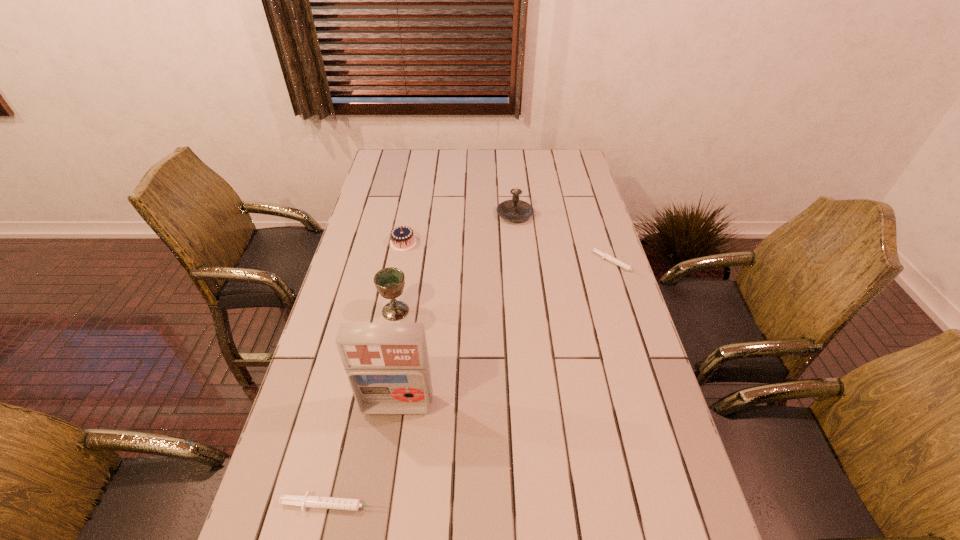
This screenshot has width=960, height=540. What are the coordinates of `the left syringe` in the screenshot? It's located at [349, 504].

Locate an element on the screen. the fifth tallest object is located at coordinates (349, 504).

Where is `the shortest object`? The image size is (960, 540). the shortest object is located at coordinates (623, 265).

Locate an element on the screen. The height and width of the screenshot is (540, 960). the rightmost object is located at coordinates (623, 265).

Where is `chalice`? The image size is (960, 540). chalice is located at coordinates (389, 282).

The height and width of the screenshot is (540, 960). I want to click on chocolate cake, so click(402, 238).

At what (x,y) coordinates should I click in order to perform the action: click on candle. Please return your answer as a coordinate pair (x, y). Looking at the image, I should click on pos(513,210).

The image size is (960, 540). I want to click on the second object from right to left, so click(513, 210).

This screenshot has width=960, height=540. I want to click on the second nearest object, so click(387, 364).

Where is `the tallest object`? The width and height of the screenshot is (960, 540). the tallest object is located at coordinates (387, 364).